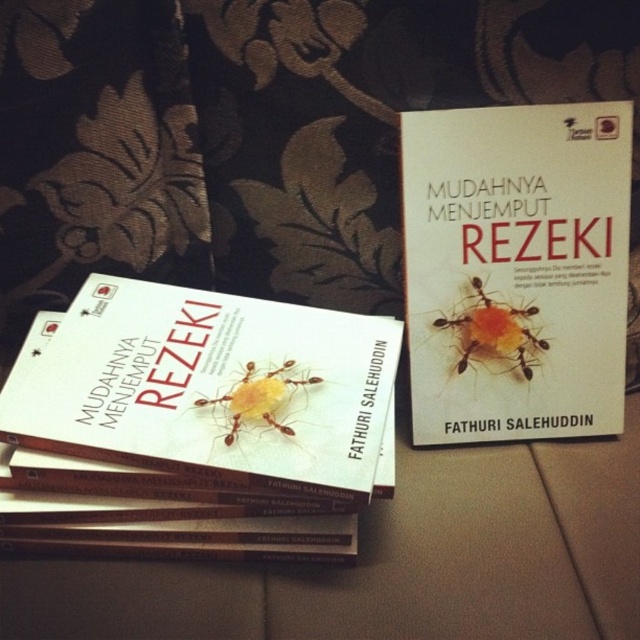
You are taking a photo of the book stack and want to focus on the point at the bottom of the stack. Which point, point (616, 323) or point (189, 524), is closer to the camera?

Point (189, 524) is closer to the camera because it is nearer than point (616, 323) which is further away.

You are organizing books on a shelf and see the white matte book at upper right and the white matte book at center. Which book is positioned higher up?

The white matte book at upper right is located above the white matte book at center, so it is positioned higher up.

In the scene shown: You are organizing a bookshelf and need to place a new book. You see the point marked at coordinates (516, 269). What object is located at that point?

The point at coordinates (516, 269) indicates the white matte book at upper right.